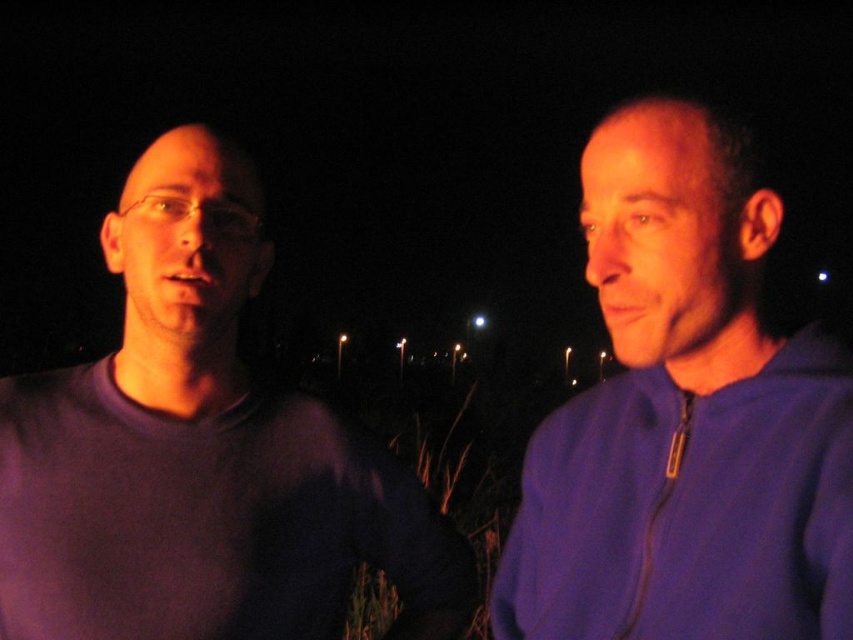
Question: Can you confirm if purple matte shirt at left is positioned to the left of purple zip-up jacket at right?

Choices:
 (A) no
 (B) yes

Answer: (B)

Question: Which point appears farthest from the camera in this image?

Choices:
 (A) (399, 500)
 (B) (703, 465)

Answer: (A)

Question: Does purple matte shirt at left have a larger size compared to purple zip-up jacket at right?

Choices:
 (A) no
 (B) yes

Answer: (B)

Question: Does purple matte shirt at left appear under purple zip-up jacket at right?

Choices:
 (A) yes
 (B) no

Answer: (A)

Question: Among these points, which one is farthest from the camera?

Choices:
 (A) (764, 556)
 (B) (144, 458)

Answer: (B)